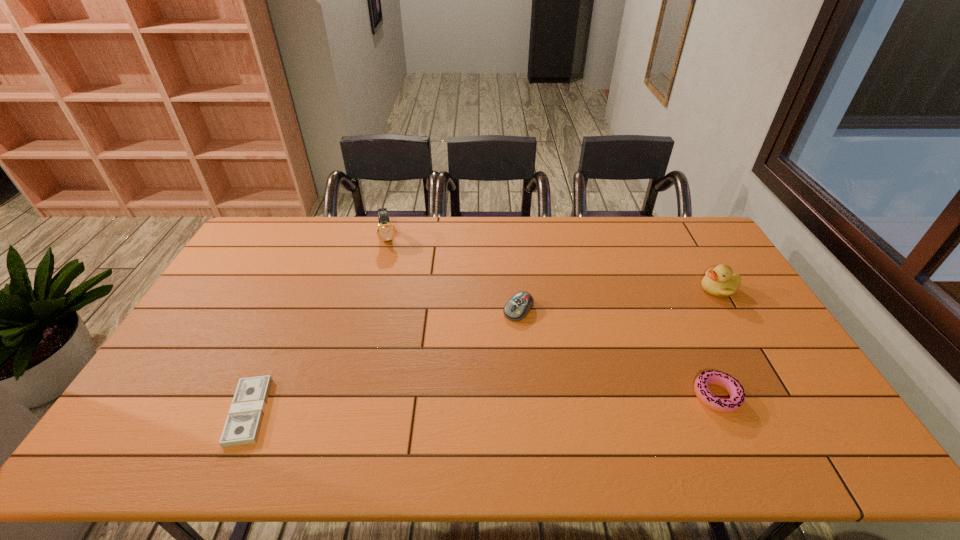
The width and height of the screenshot is (960, 540). What are the coordinates of `dollar` in the screenshot? It's located at (242, 427).

Find the location of `the shortest object`. the shortest object is located at coordinates (242, 427).

Identify the location of doughnut. Image resolution: width=960 pixels, height=540 pixels. (736, 391).

The height and width of the screenshot is (540, 960). In order to click on duckling in this screenshot , I will do `click(719, 281)`.

At what (x,y) coordinates should I click in order to perform the action: click on the fourth shortest object. Please return your answer as a coordinate pair (x, y). The height and width of the screenshot is (540, 960). Looking at the image, I should click on (719, 281).

This screenshot has height=540, width=960. Find the location of `computer mouse`. computer mouse is located at coordinates (517, 308).

The width and height of the screenshot is (960, 540). What are the coordinates of `the farthest object` in the screenshot? It's located at (385, 231).

What are the coordinates of `the tallest object` in the screenshot? It's located at (385, 231).

Find the location of a particular element. The height and width of the screenshot is (540, 960). vacant space located 0.370m on the right of the shortest object is located at coordinates (418, 411).

Find the location of a particular element. This screenshot has width=960, height=540. blank area located on the back of the doughnut is located at coordinates (678, 313).